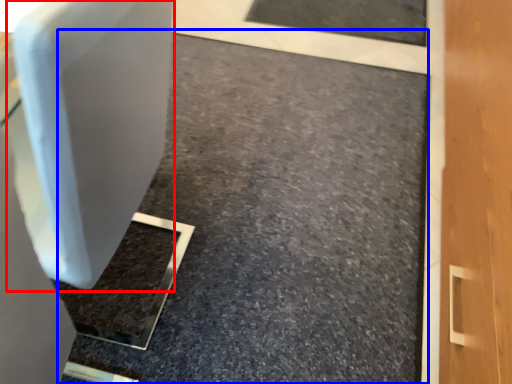
Question: Which object appears closest to the camera in this image, swivel chair (highlighted by a red box) or concrete (highlighted by a blue box)?

Choices:
 (A) swivel chair
 (B) concrete

Answer: (A)